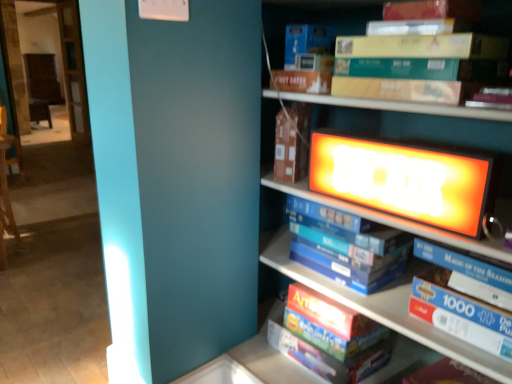
Question: From a real-world perspective, is blue cardboard puzzle at center, placed as the 2th book when sorted from top to bottom, positioned above or below yellow cardboard book at upper right, which is counted as the 4th book, starting from the bottom?

Choices:
 (A) above
 (B) below

Answer: (B)

Question: Is blue cardboard puzzle at center, placed as the 2th book when sorted from top to bottom, in front of or behind yellow cardboard book at upper right, the 1th book in the top-to-bottom sequence, in the image?

Choices:
 (A) behind
 (B) front

Answer: (A)

Question: Estimate the real-world distances between objects in this image. Which object is closer to the blue cardboard puzzle at center, placed as the 2th book when sorted from top to bottom?

Choices:
 (A) yellow cardboard book at upper right, the 1th book in the top-to-bottom sequence
 (B) brown cardboard book at center
 (C) matte wooden bookcase at upper right
 (D) white glossy puzzle box at center, which is counted as the second book, starting from the bottom
 (E) red matte puzzle box at lower center, which is counted as the fourth book, starting from the top

Answer: (E)

Question: Which is farther from the white glossy puzzle box at center, which is counted as the second book, starting from the bottom?

Choices:
 (A) matte wooden bookcase at upper right
 (B) red matte puzzle box at lower center, which is counted as the fourth book, starting from the top
 (C) yellow cardboard book at upper right, which is counted as the 4th book, starting from the bottom
 (D) brown cardboard book at center
 (E) blue cardboard puzzle at center, placed as the 2th book when sorted from top to bottom

Answer: (C)